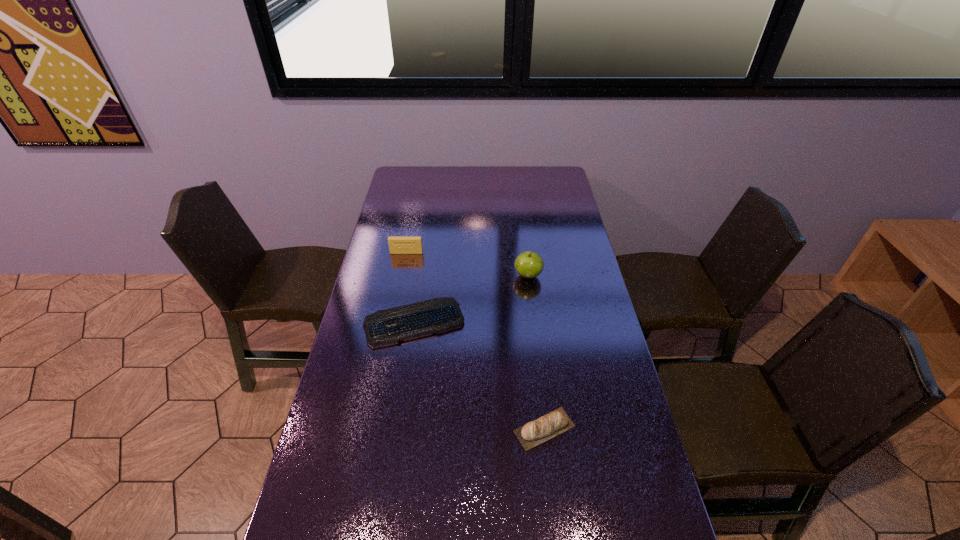
Locate an element on the screen. The width and height of the screenshot is (960, 540). free space that satisfies the following two spatial constraints: 1. at the front of the third shortest object with spools; 2. on the right side of the pita bread is located at coordinates (372, 429).

Identify the location of free space that satisfies the following two spatial constraints: 1. on the front side of the second shortest object; 2. on the right side of the shortest object. The image size is (960, 540). (398, 429).